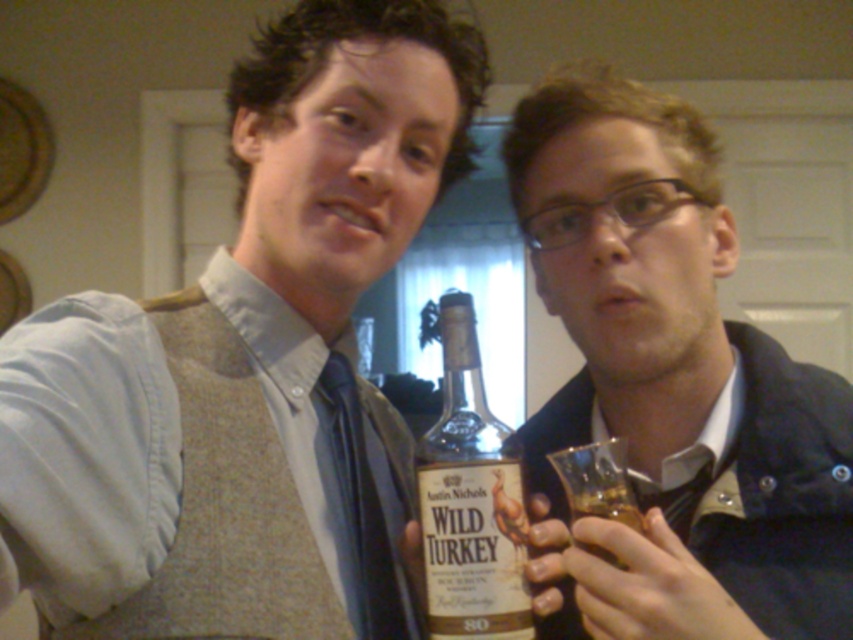
Who is higher up, matte black jacket at center or black silk tie at center?

matte black jacket at center

Consider the image. Between matte black jacket at center and black silk tie at center, which one is positioned lower?

black silk tie at center is below.

Identify the location of matte black jacket at center. click(670, 387).

Who is lower down, matte glass bottle at center or translucent amber liquid at lower right?

translucent amber liquid at lower right

Is matte glass bottle at center positioned behind translucent amber liquid at lower right?

Yes, it is.

Does point (479, 529) come closer to viewer compared to point (636, 522)?

No, it is not.

Find the location of a particular element. The height and width of the screenshot is (640, 853). matte glass bottle at center is located at coordinates (469, 499).

Which of these two, matte black jacket at center or translucent amber liquid at lower right, stands taller?

matte black jacket at center

Is matte black jacket at center to the right of translucent amber liquid at lower right from the viewer's perspective?

Yes, matte black jacket at center is to the right of translucent amber liquid at lower right.

What do you see at coordinates (670, 387) in the screenshot?
I see `matte black jacket at center` at bounding box center [670, 387].

What are the coordinates of `matte black jacket at center` in the screenshot? It's located at (670, 387).